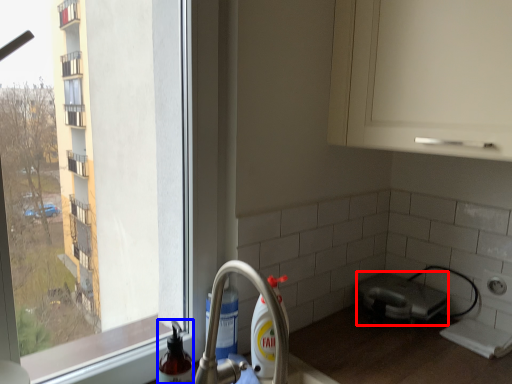
Question: Among these objects, which one is farthest to the camera, appliance (highlighted by a red box) or cleaning product (highlighted by a blue box)?

Choices:
 (A) appliance
 (B) cleaning product

Answer: (A)